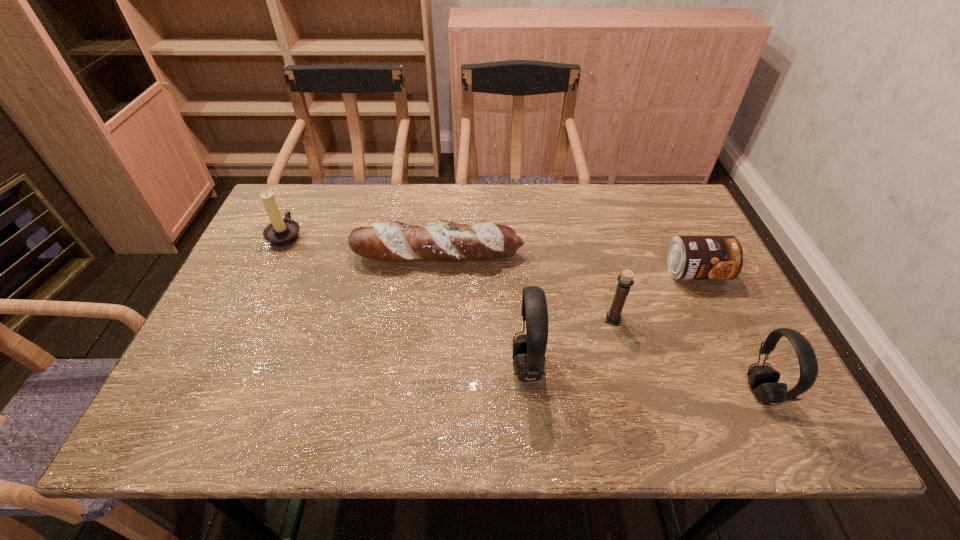
Where is `the taller headset`? The height and width of the screenshot is (540, 960). the taller headset is located at coordinates (529, 349).

Locate an element on the screen. This screenshot has width=960, height=540. the tallest object is located at coordinates (529, 349).

You are a GUI agent. You are given a task and a screenshot of the screen. Output one action in this format:
    pyautogui.click(x=<x>, y=<y>)
    Task: Click on the right headset
    This screenshot has width=960, height=540.
    Given the screenshot: What is the action you would take?
    pyautogui.click(x=763, y=380)

Find the location of a particular element. The width and height of the screenshot is (960, 540). can is located at coordinates (688, 257).

Locate an element on the screen. Image resolution: width=960 pixels, height=540 pixels. baguet is located at coordinates (441, 240).

Identify the location of the farther candle holder. (281, 232).

Identify the location of the left candle holder. This screenshot has height=540, width=960. (281, 232).

Locate an element on the screen. This screenshot has height=540, width=960. the third object from right to left is located at coordinates (625, 280).

In order to click on the right candle holder in this screenshot , I will do `click(625, 280)`.

This screenshot has width=960, height=540. I want to click on free space located 0.230m on the front-facing side of the left headset, so 405,367.